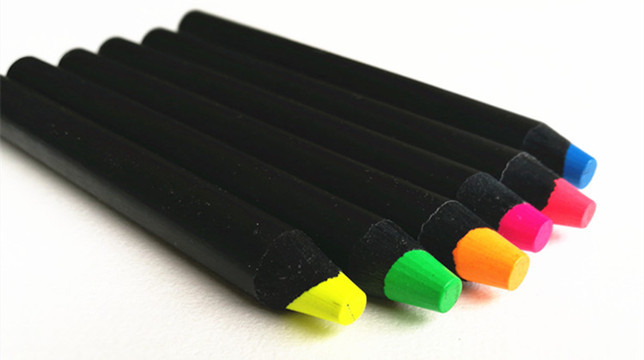
The width and height of the screenshot is (644, 360). Identify the location of colored markers. (348, 310), (428, 294), (511, 261), (532, 225), (574, 207), (583, 168).